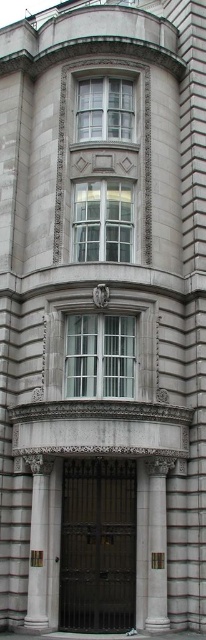
Which is above, white marble pillar at lower left or satin gold metal at center?

satin gold metal at center is higher up.

Is point (37, 566) in front of point (153, 483)?

Yes.

Where is `white marble pillar at lower left`? white marble pillar at lower left is located at coordinates (37, 541).

Does dark brown metal gate at center have a larger size compared to white marble pillar at lower left?

Yes, dark brown metal gate at center is bigger than white marble pillar at lower left.

Is point (133, 600) farther from viewer compared to point (43, 573)?

Yes, it is.

The width and height of the screenshot is (206, 640). Find the location of `dark brown metal gate at center`. dark brown metal gate at center is located at coordinates (98, 545).

Image resolution: width=206 pixels, height=640 pixels. I want to click on dark brown metal gate at center, so click(x=98, y=545).

Does dark brown metal gate at center appear over satin gold metal at center?

Incorrect, dark brown metal gate at center is not positioned above satin gold metal at center.

Is dark brown metal gate at center wider than satin gold metal at center?

Indeed, dark brown metal gate at center has a greater width compared to satin gold metal at center.

Does point (103, 513) come farther from viewer compared to point (161, 496)?

Yes, point (103, 513) is behind point (161, 496).

Where is `dark brown metal gate at center`? This screenshot has height=640, width=206. dark brown metal gate at center is located at coordinates (98, 545).